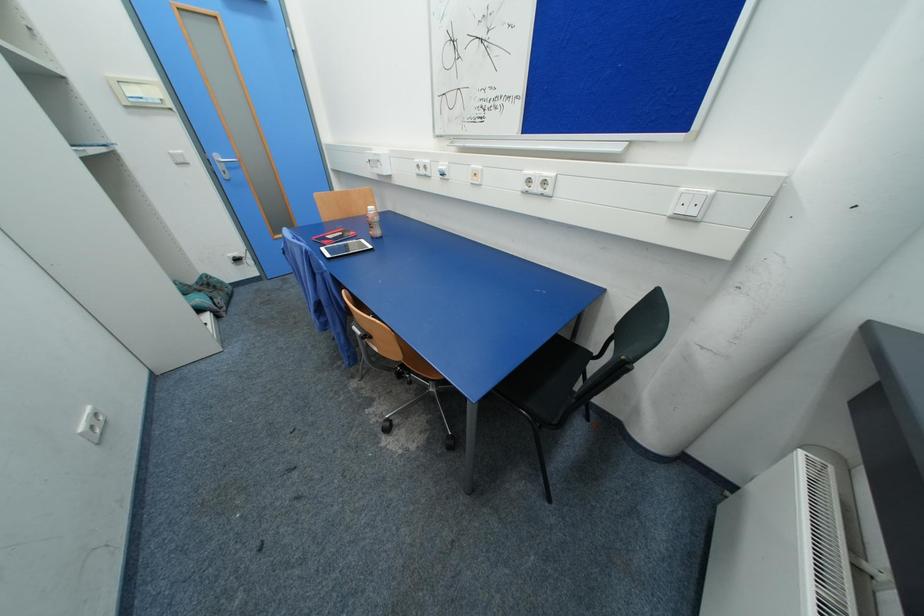
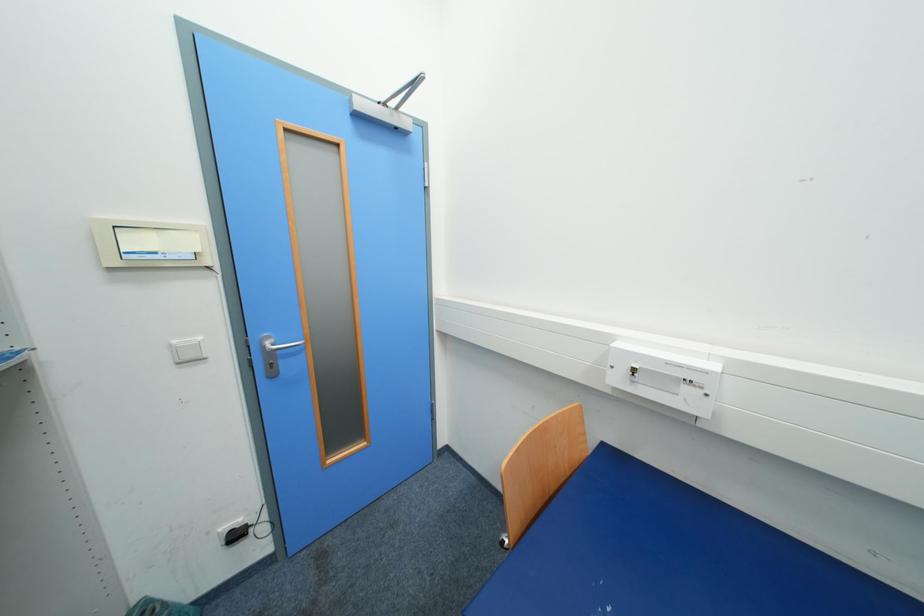
Which direction would the cameraman need to move to produce the second image?

The cameraman moved toward left, forward.